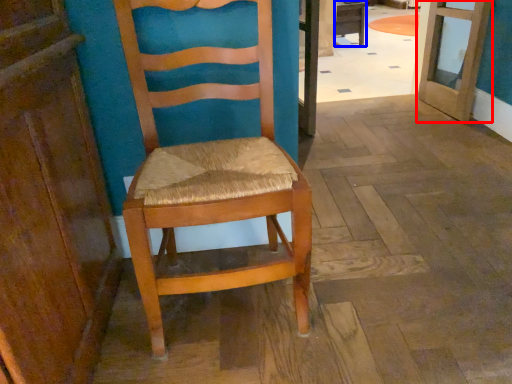
Question: Which object appears closest to the camera in this image, door (highlighted by a red box) or table (highlighted by a blue box)?

Choices:
 (A) door
 (B) table

Answer: (A)